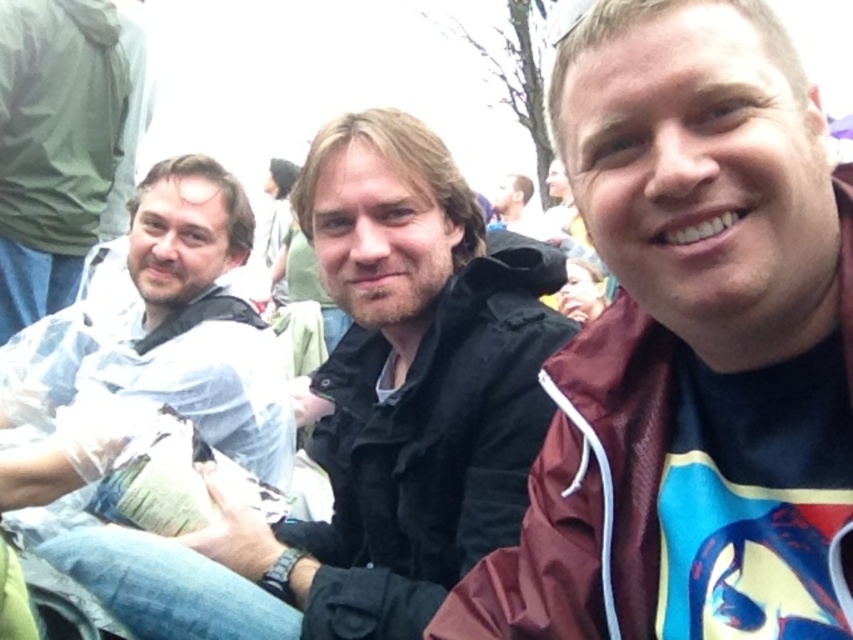
Can you confirm if maroon fabric jacket at right is positioned to the right of white plastic bag at left?

Indeed, maroon fabric jacket at right is positioned on the right side of white plastic bag at left.

Who is more forward, (666,83) or (186,202)?

Point (666,83) is in front.

The width and height of the screenshot is (853, 640). Find the location of `maroon fabric jacket at right`. maroon fabric jacket at right is located at coordinates (689, 346).

Who is more distant from viewer, [358,387] or [224,244]?

The point [224,244] is more distant.

What do you see at coordinates (409, 385) in the screenshot? I see `matte black jacket at center` at bounding box center [409, 385].

At what (x,y) coordinates should I click in order to perform the action: click on matte black jacket at center. Please return your answer as a coordinate pair (x, y). Looking at the image, I should click on (409, 385).

Locate an element on the screen. This screenshot has width=853, height=640. matte black jacket at center is located at coordinates (409, 385).

Who is more distant from viewer, (693, 138) or (418, 616)?

Positioned behind is point (418, 616).

Is the position of maroon fabric jacket at right less distant than that of matte black jacket at center?

Yes.

Locate an element on the screen. This screenshot has width=853, height=640. maroon fabric jacket at right is located at coordinates (689, 346).